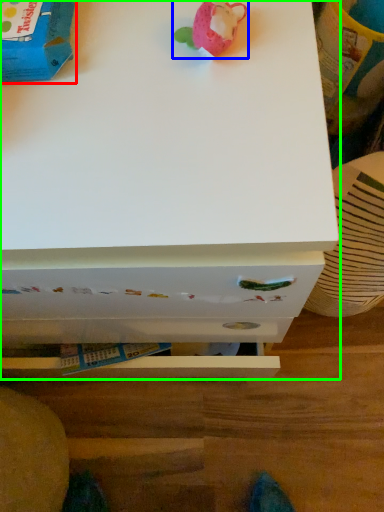
Question: Considering the real-world distances, which object is farthest from toy (highlighted by a red box)? toy (highlighted by a blue box) or chest of drawers (highlighted by a green box)?

Choices:
 (A) toy
 (B) chest of drawers

Answer: (B)